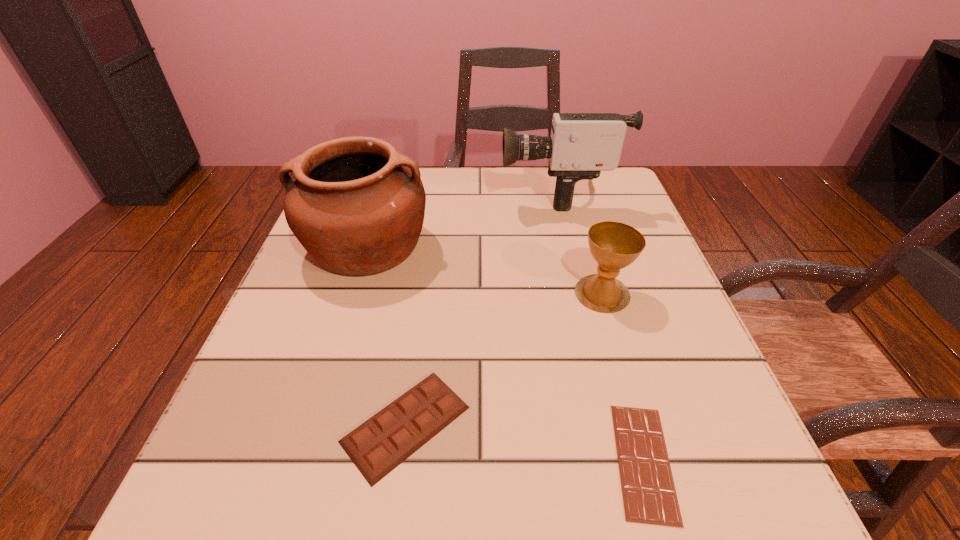
This screenshot has width=960, height=540. What are the coordinates of `object that is positioned at the far left corner` in the screenshot? It's located at (357, 206).

Find the location of a particular element. The width and height of the screenshot is (960, 540). object that is at the far right corner is located at coordinates (581, 145).

The height and width of the screenshot is (540, 960). Find the location of `object that is positioned at the near right corner`. object that is positioned at the near right corner is located at coordinates (649, 495).

In the image, there is a desktop. Where is `vacant area at the far edge`? vacant area at the far edge is located at coordinates (526, 200).

At what (x,y) coordinates should I click in order to perform the action: click on vacant area at the near edge. Please return your answer as a coordinate pair (x, y). The width and height of the screenshot is (960, 540). Looking at the image, I should click on (491, 498).

You are a GUI agent. You are given a task and a screenshot of the screen. Output one action in this format:
    pyautogui.click(x=<x>, y=<y>)
    Task: Click on the vacant space at the left edge of the desktop
    This screenshot has width=960, height=540.
    Given the screenshot: What is the action you would take?
    pyautogui.click(x=314, y=377)

This screenshot has height=540, width=960. In the image, there is a desktop. What are the coordinates of `vacant space at the right edge` in the screenshot? It's located at (701, 403).

Locate an element on the screen. This screenshot has height=540, width=960. vacant space at the far right corner is located at coordinates click(582, 219).

The image size is (960, 540). What are the coordinates of `free space between the pottery and the third shortest object` in the screenshot? It's located at (485, 270).

At what (x,y) coordinates should I click in order to perform the action: click on unoccupied area between the pottery and the left chocolate bar. Please return your answer as a coordinate pair (x, y). Looking at the image, I should click on (386, 335).